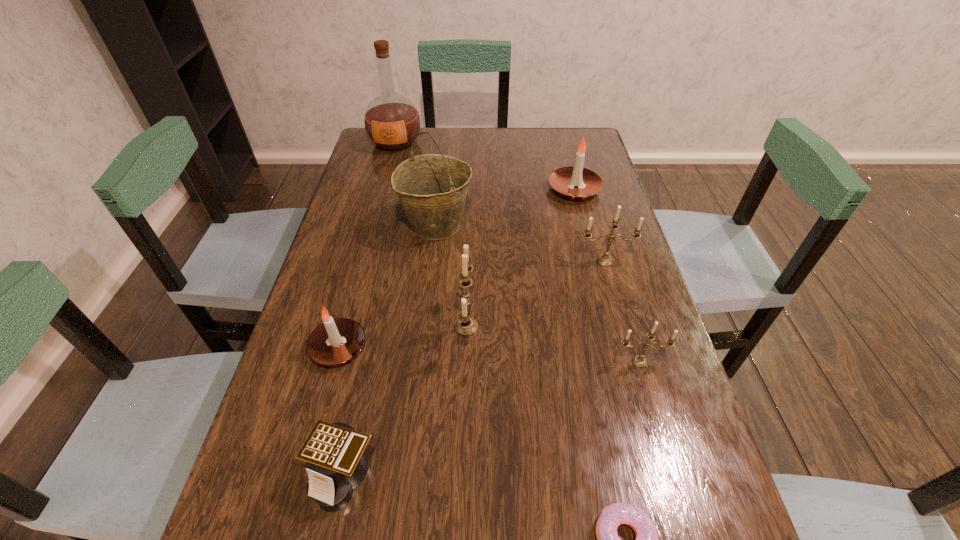
Locate an element on the screen. vacant space positioned on the left of the second shortest object is located at coordinates (247, 476).

Locate an element on the screen. The height and width of the screenshot is (540, 960). object at the far edge is located at coordinates (391, 120).

At what (x,y) coordinates should I click in order to perform the action: click on liquor situated at the left edge. Please return your answer as a coordinate pair (x, y). This screenshot has height=540, width=960. Looking at the image, I should click on (391, 120).

Find the location of `candle present at the left edge`. candle present at the left edge is located at coordinates (335, 341).

Where is `calculator present at the left edge`? calculator present at the left edge is located at coordinates (335, 452).

Locate an element on the screen. The height and width of the screenshot is (540, 960). object that is at the far left corner is located at coordinates (391, 120).

Locate an element on the screen. The height and width of the screenshot is (540, 960). vacant space at the far edge of the desktop is located at coordinates (487, 132).

Find the location of a particular element. vacant space at the left edge is located at coordinates point(396,211).

In the image, there is a desktop. Where is `vacant space at the right edge`? vacant space at the right edge is located at coordinates (676, 428).

This screenshot has width=960, height=540. Find the location of `vacant space at the far left corner of the desktop`. vacant space at the far left corner of the desktop is located at coordinates (405, 153).